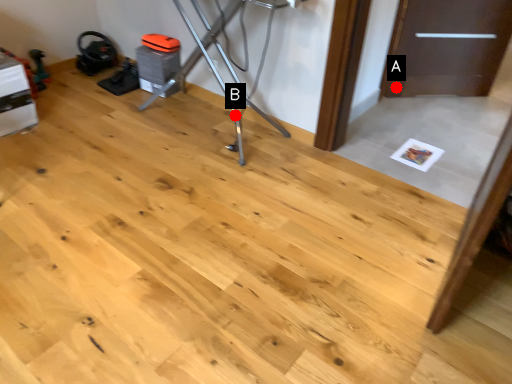
Question: Two points are circled on the image, labeled by A and B beside each circle. Which point is closer to the camera taking this photo?

Choices:
 (A) A is closer
 (B) B is closer

Answer: (B)